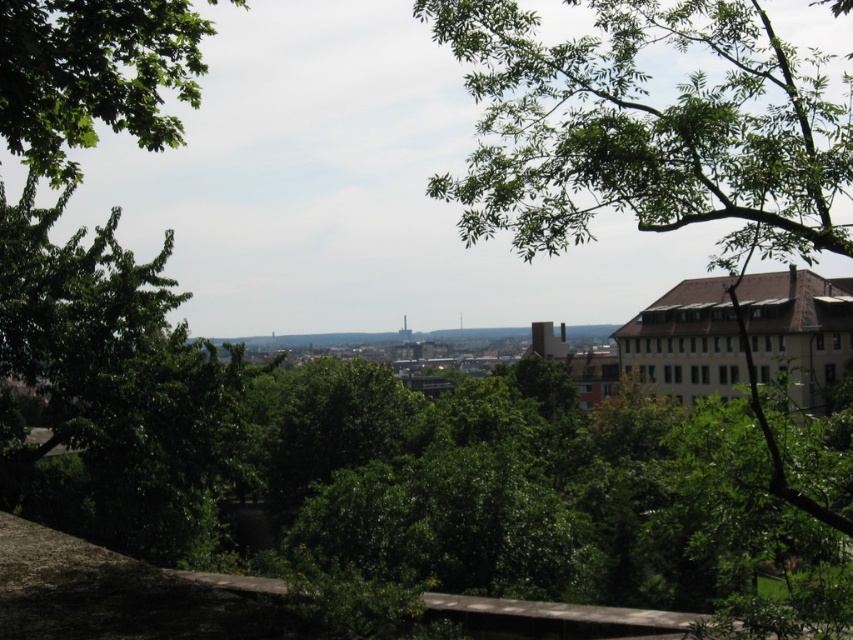
Question: Can you confirm if green leafy tree at upper center is positioned to the right of green leafy tree at upper left?

Choices:
 (A) no
 (B) yes

Answer: (B)

Question: Among these points, which one is nearest to the camera?

Choices:
 (A) (807, 189)
 (B) (102, 76)

Answer: (A)

Question: Is the position of green leafy tree at upper center less distant than that of green leafy tree at upper left?

Choices:
 (A) yes
 (B) no

Answer: (B)

Question: Can you confirm if green leafy tree at upper center is positioned to the left of green leafy tree at upper left?

Choices:
 (A) yes
 (B) no

Answer: (B)